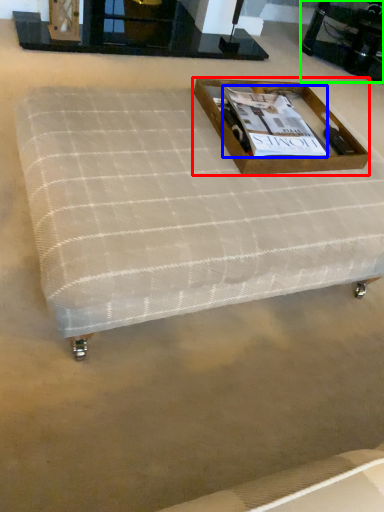
Question: Based on their relative distances, which object is farther from box (highlighted by a red box)? Choose from magazine (highlighted by a blue box) and round table (highlighted by a green box).

Choices:
 (A) magazine
 (B) round table

Answer: (B)